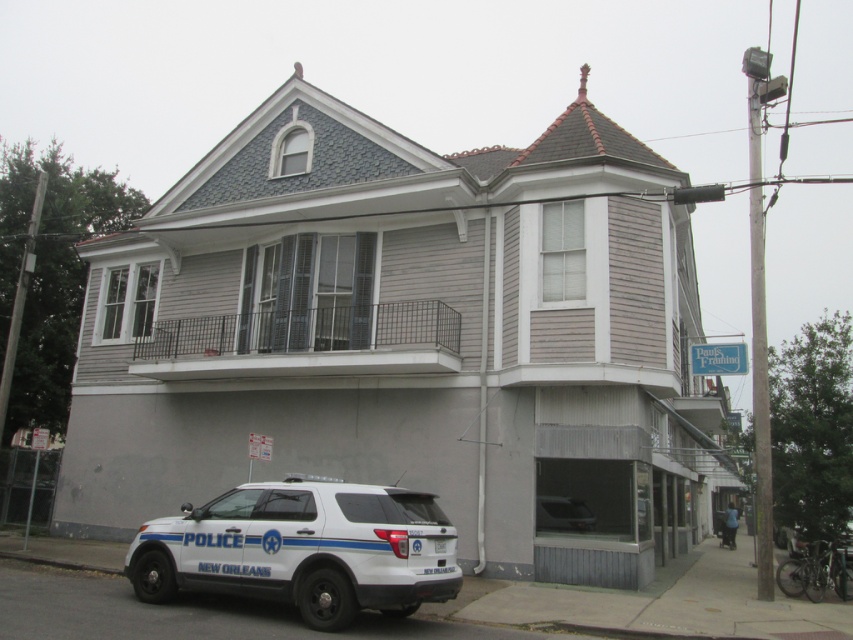
Question: Does white matte police car at lower left appear on the left side of blue metallic police car at lower right?

Choices:
 (A) yes
 (B) no

Answer: (A)

Question: Which of the following is the closest to the observer?

Choices:
 (A) white matte police car at lower left
 (B) blue metallic police car at lower right
 (C) metallic gray sedan at lower center

Answer: (A)

Question: Which point is farther to the camera?

Choices:
 (A) (587, 513)
 (B) (735, 529)

Answer: (B)

Question: Does metallic gray sedan at lower center have a smaller size compared to blue metallic police car at lower right?

Choices:
 (A) no
 (B) yes

Answer: (B)

Question: Is white matte police car at lower left thinner than blue metallic police car at lower right?

Choices:
 (A) no
 (B) yes

Answer: (A)

Question: Which object appears closest to the camera in this image?

Choices:
 (A) white matte police car at lower left
 (B) metallic gray sedan at lower center

Answer: (A)